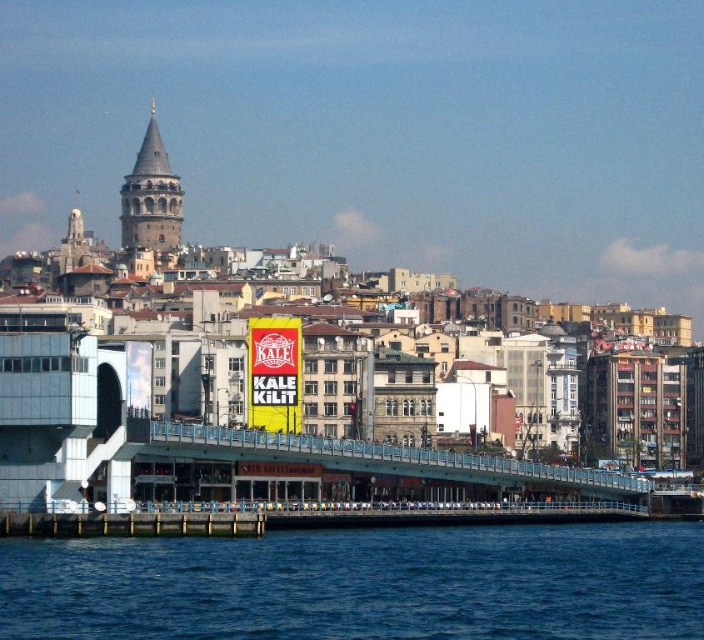
Question: Is the position of blue metallic bridge at center less distant than that of red/yellow sign at center?

Choices:
 (A) yes
 (B) no

Answer: (A)

Question: Based on their relative distances, which object is nearer to the blue metallic bridge at center?

Choices:
 (A) red/yellow sign at center
 (B) blue water at lower left

Answer: (B)

Question: Is blue water at lower left bigger than blue metallic bridge at center?

Choices:
 (A) yes
 (B) no

Answer: (A)

Question: Which object is the farthest from the blue metallic bridge at center?

Choices:
 (A) blue water at lower left
 (B) red/yellow sign at center

Answer: (B)

Question: Which point is farther from the camera taking this photo?

Choices:
 (A) (172, 442)
 (B) (270, 413)

Answer: (B)

Question: Observing the image, what is the correct spatial positioning of blue water at lower left in reference to red/yellow sign at center?

Choices:
 (A) right
 (B) left

Answer: (A)